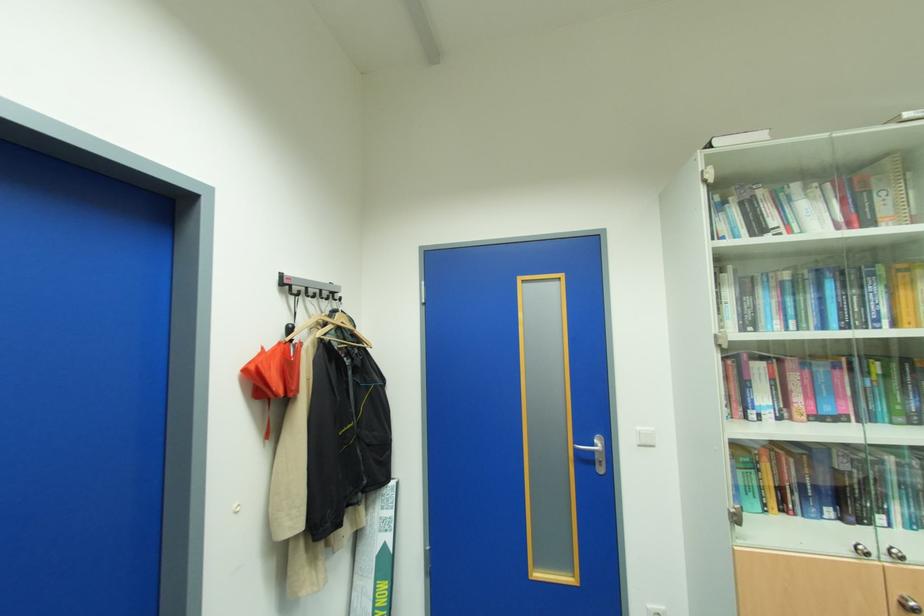
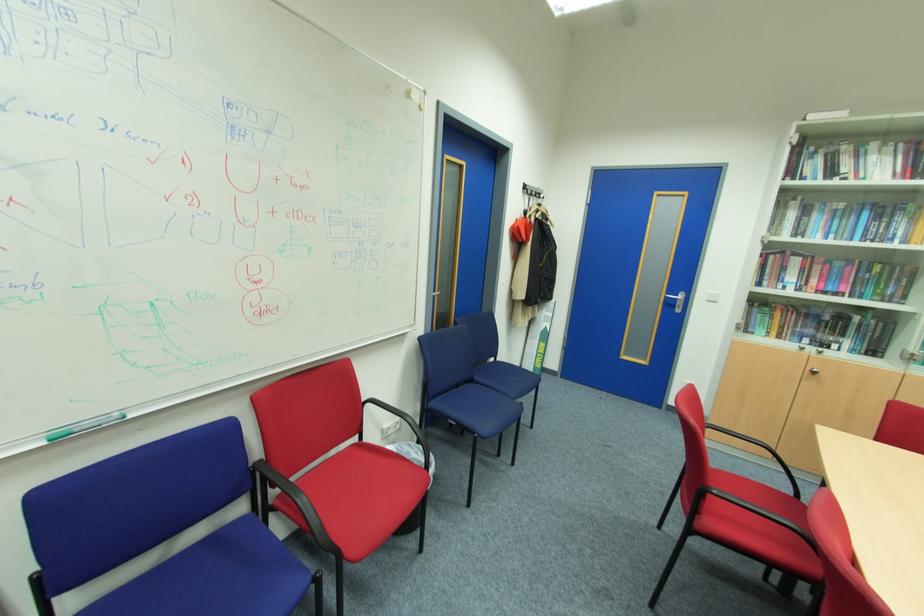
Where in the second image is the point corresponding to (x=642, y=446) from the first image?

(711, 301)